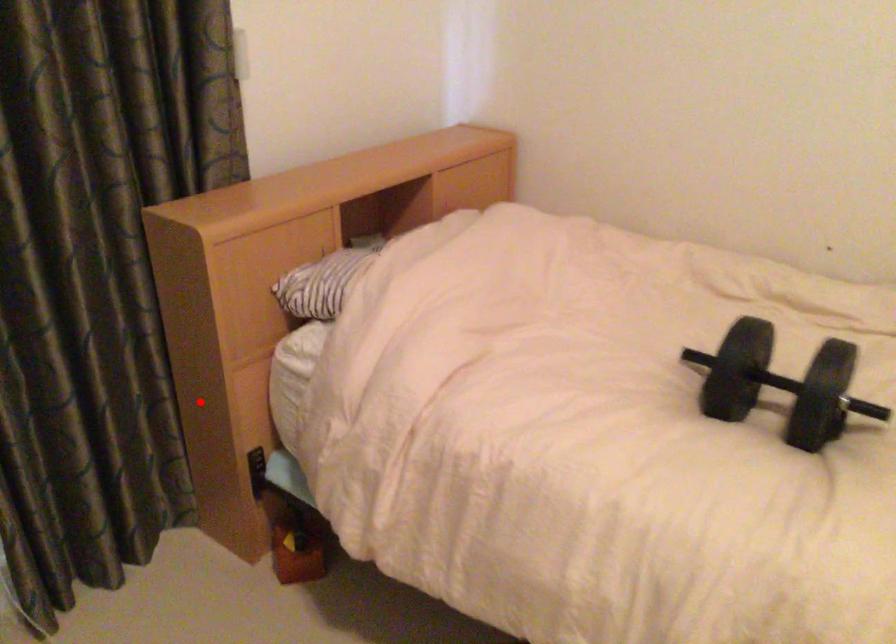
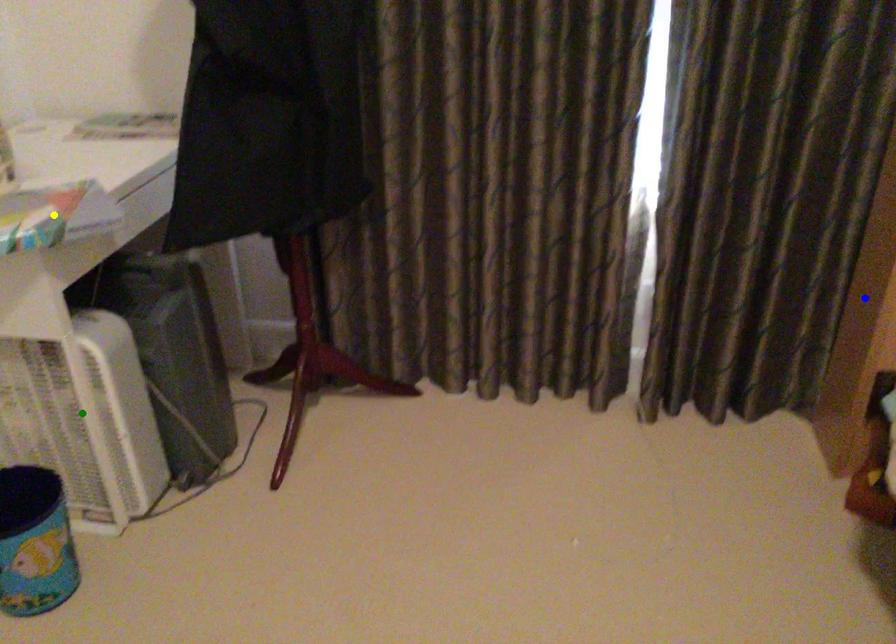
Question: I am providing you with two images of the same scene from different viewpoints. A red point is marked on the first image. You are given multiple points on the second image. Which mark in image 2 goes with the point in image 1?

Choices:
 (A) yellow point
 (B) green point
 (C) blue point

Answer: (C)